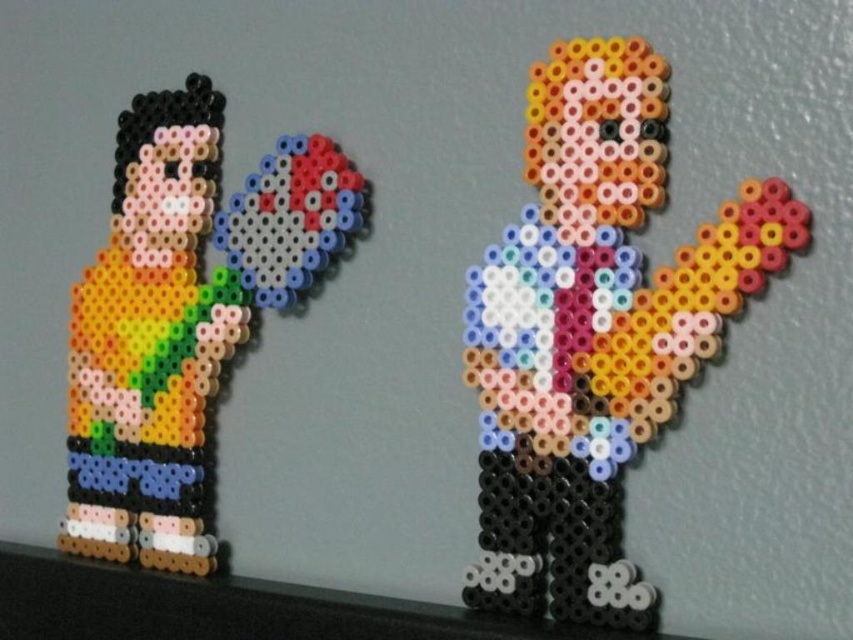
Does point (585, 324) come behind point (193, 230)?

No.

Is multicolored beads man at center bigger than multicolored beads at left?

No, multicolored beads man at center is not bigger than multicolored beads at left.

Identify the location of multicolored beads man at center. (595, 332).